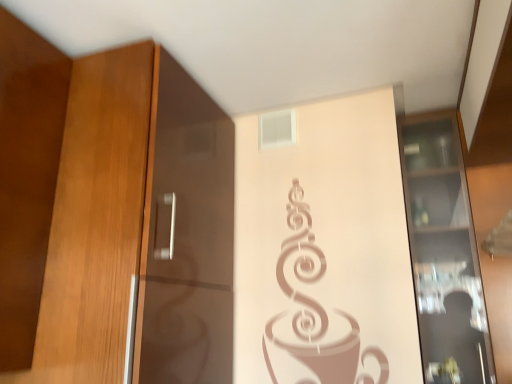
This screenshot has width=512, height=384. In order to click on transparent glass cabinet at right in this screenshot , I will do `click(444, 252)`.

The image size is (512, 384). Describe the element at coordinates (444, 252) in the screenshot. I see `transparent glass cabinet at right` at that location.

What are the coordinates of `transparent glass cabinet at right` in the screenshot? It's located at (444, 252).